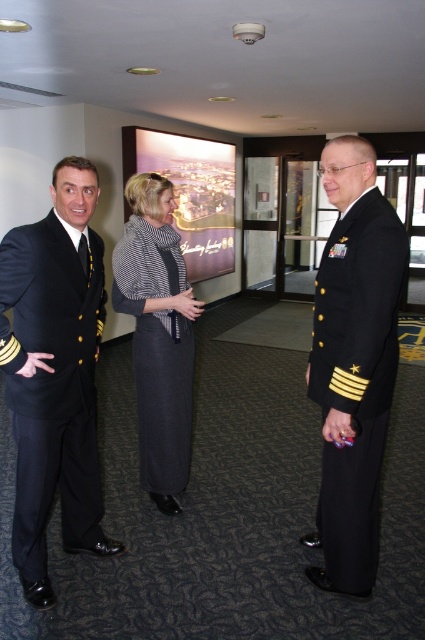
You are a photographer preparing to take a group photo of the shiny black suit at left and the shiny black uniform at center. Based on their heights, which one should you position closer to the camera to ensure both appear equally tall in the photo?

The shiny black suit at left has a lesser height compared to the shiny black uniform at center. To make them appear equally tall in the photo, position the shiny black suit at left closer to the camera since it is shorter.

Looking at this image, you are a tailor who needs to determine which suit requires more fabric to make between the black wool suit at center and the shiny black suit at left. Based on the image, which one needs more fabric?

The shiny black suit at left requires more fabric since it is larger than the black wool suit at center.